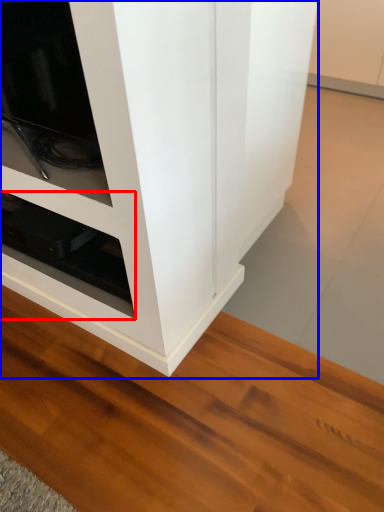
Question: Which object is closer to the camera taking this photo, shelf (highlighted by a red box) or cupboard (highlighted by a blue box)?

Choices:
 (A) shelf
 (B) cupboard

Answer: (B)